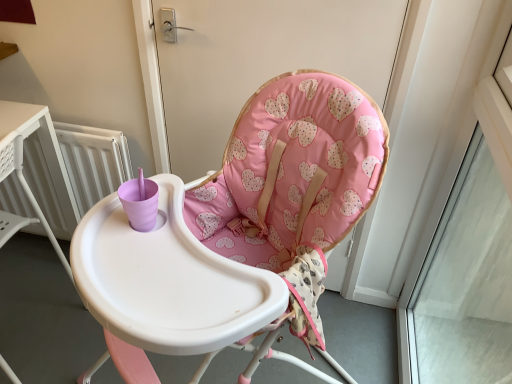
Question: Is transparent glass window at upper right shorter than pink fabric highchair at center?

Choices:
 (A) no
 (B) yes

Answer: (A)

Question: From the image's perspective, is transparent glass window at upper right located above pink fabric highchair at center?

Choices:
 (A) no
 (B) yes

Answer: (B)

Question: Can you confirm if transparent glass window at upper right is smaller than pink fabric highchair at center?

Choices:
 (A) yes
 (B) no

Answer: (A)

Question: Is transparent glass window at upper right not inside pink fabric highchair at center?

Choices:
 (A) no
 (B) yes

Answer: (B)

Question: Is transparent glass window at upper right facing away from pink fabric highchair at center?

Choices:
 (A) no
 (B) yes

Answer: (B)

Question: From the image's perspective, is transparent glass window at upper right beneath pink fabric highchair at center?

Choices:
 (A) no
 (B) yes

Answer: (A)

Question: Can you confirm if transparent glass window at upper right is bigger than pink fabric cushion at center?

Choices:
 (A) no
 (B) yes

Answer: (B)

Question: Is transparent glass window at upper right positioned in front of pink fabric cushion at center?

Choices:
 (A) yes
 (B) no

Answer: (A)

Question: Is transparent glass window at upper right behind pink fabric cushion at center?

Choices:
 (A) yes
 (B) no

Answer: (B)

Question: Is transparent glass window at upper right facing away from pink fabric cushion at center?

Choices:
 (A) yes
 (B) no

Answer: (B)

Question: Can you confirm if transparent glass window at upper right is smaller than pink fabric cushion at center?

Choices:
 (A) no
 (B) yes

Answer: (A)

Question: From a real-world perspective, is transparent glass window at upper right located beneath pink fabric cushion at center?

Choices:
 (A) no
 (B) yes

Answer: (B)

Question: Is pink fabric cushion at center positioned with its back to white radiator at left?

Choices:
 (A) yes
 (B) no

Answer: (B)